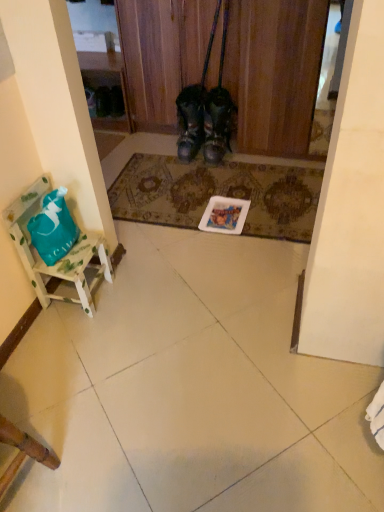
At what (x,y) coordinates should I click in order to perform the action: click on free region under leather boots at center, the first footwear in the right-to-left sequence (from a real-world perspective). Please return your answer as a coordinate pair (x, y). The image size is (384, 512). Looking at the image, I should click on (216, 158).